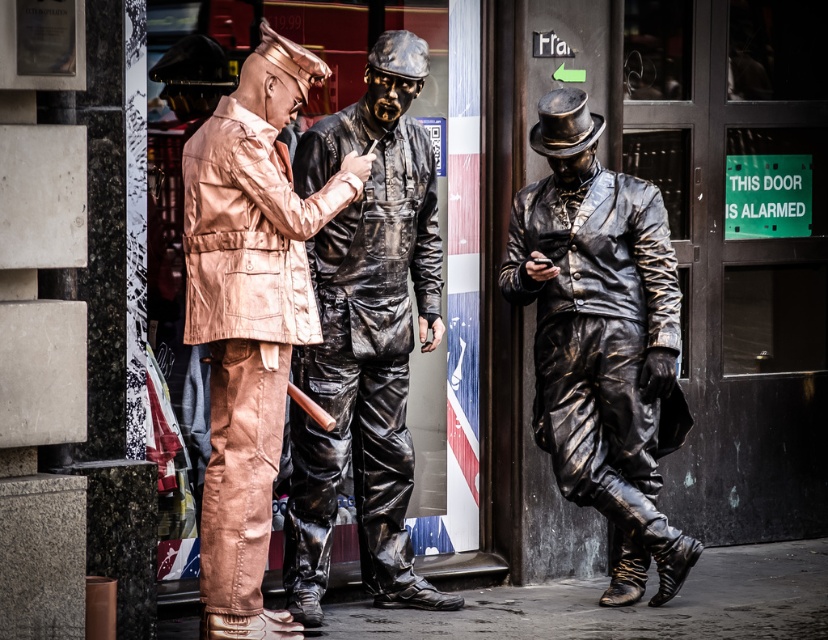
Is shiny bronze statue at center to the left of shiny bronze jacket at center from the viewer's perspective?

No, shiny bronze statue at center is not to the left of shiny bronze jacket at center.

Does shiny bronze statue at center have a lesser height compared to shiny bronze jacket at center?

In fact, shiny bronze statue at center may be taller than shiny bronze jacket at center.

Image resolution: width=828 pixels, height=640 pixels. What do you see at coordinates (602, 340) in the screenshot? I see `shiny bronze statue at center` at bounding box center [602, 340].

This screenshot has height=640, width=828. Identify the location of shiny bronze statue at center. (602, 340).

Can you confirm if shiny black suit at center is positioned above shiny bronze statue at center?

Correct, shiny black suit at center is located above shiny bronze statue at center.

In order to click on shiny black suit at center in this screenshot , I will do `click(364, 337)`.

Who is more forward, (x=301, y=442) or (x=516, y=250)?

Point (x=301, y=442) is more forward.

At what (x,y) coordinates should I click in order to perform the action: click on shiny black suit at center. Please return your answer as a coordinate pair (x, y). Looking at the image, I should click on (364, 337).

Does shiny black suit at center appear on the right side of shiny bronze jacket at center?

Yes, shiny black suit at center is to the right of shiny bronze jacket at center.

Between point (437, 330) and point (253, 436), which one is positioned behind?

The point (437, 330) is more distant.

This screenshot has height=640, width=828. What do you see at coordinates (364, 337) in the screenshot?
I see `shiny black suit at center` at bounding box center [364, 337].

The image size is (828, 640). In order to click on shiny black suit at center in this screenshot , I will do `click(364, 337)`.